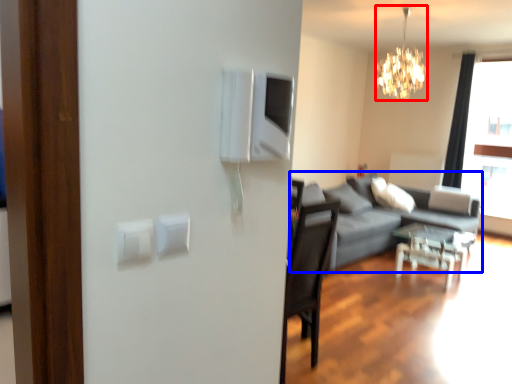
Question: Which object is closer to the camera taking this photo, lamp (highlighted by a red box) or studio couch (highlighted by a blue box)?

Choices:
 (A) lamp
 (B) studio couch

Answer: (A)